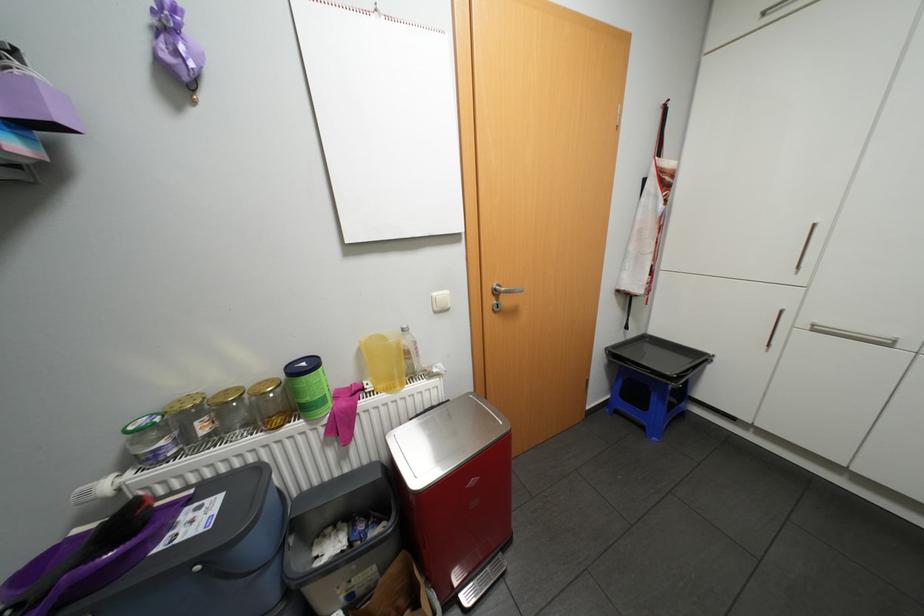
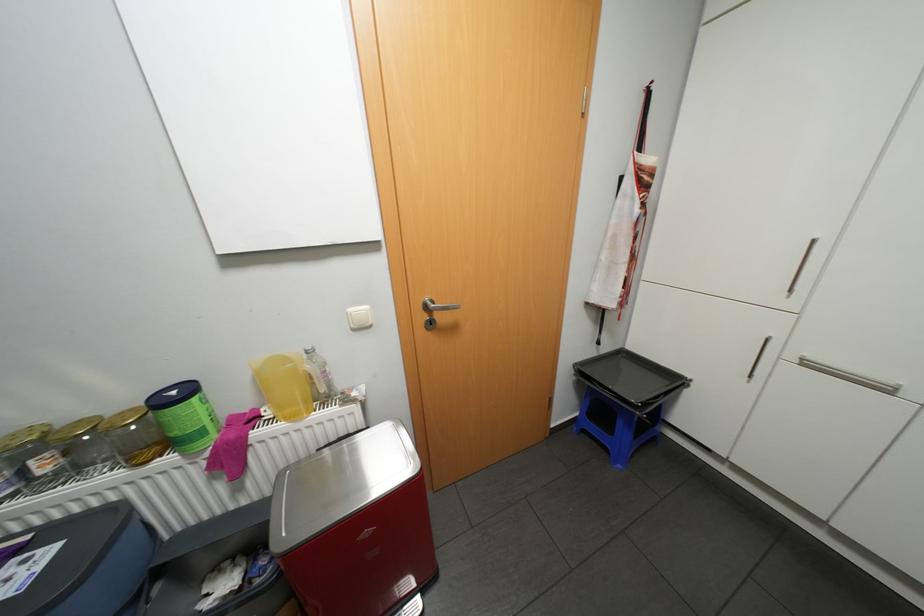
Where in the second image is the point corresponding to point (823, 329) from the first image?

(813, 363)